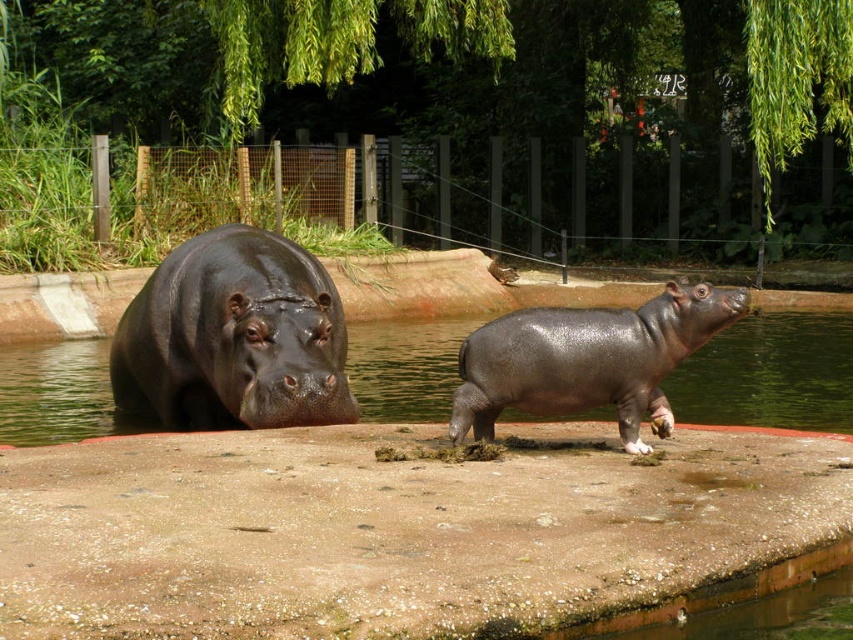
You are a zookeeper trying to assess the enclosure layout. You see the glossy water at hippo right and the shiny dark gray hippo at center. Which object is taller in the image?

The shiny dark gray hippo at center is taller than the glossy water at hippo right.

You are a zookeeper observing the hippos in their enclosure. You notice the shiny dark brown hippo at left and the shiny dark gray hippo at center. Which hippo is positioned higher in the image?

The shiny dark brown hippo at left is positioned higher in the image than the shiny dark gray hippo at center because it is located above it according to the description.

Based on the photo, you are a zookeeper trying to locate the shiny dark brown hippo at left in its enclosure. Based on the coordinates provided, where would you find it in relation to the center of the enclosure?

The shiny dark brown hippo at left is located at coordinates point (231, 339), which places it slightly to the right and above the center of the enclosure.